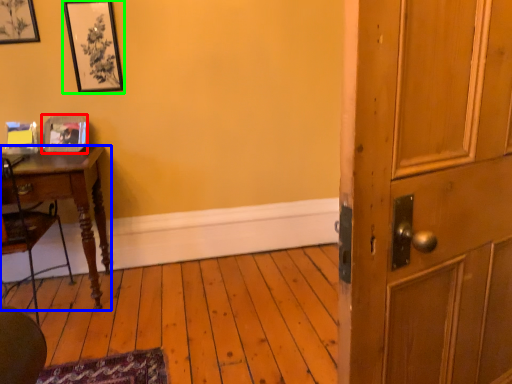
Question: Which object is the farthest from picture frame (highlighted by a red box)? Choose among these: desk (highlighted by a blue box) or picture frame (highlighted by a green box).

Choices:
 (A) desk
 (B) picture frame

Answer: (B)